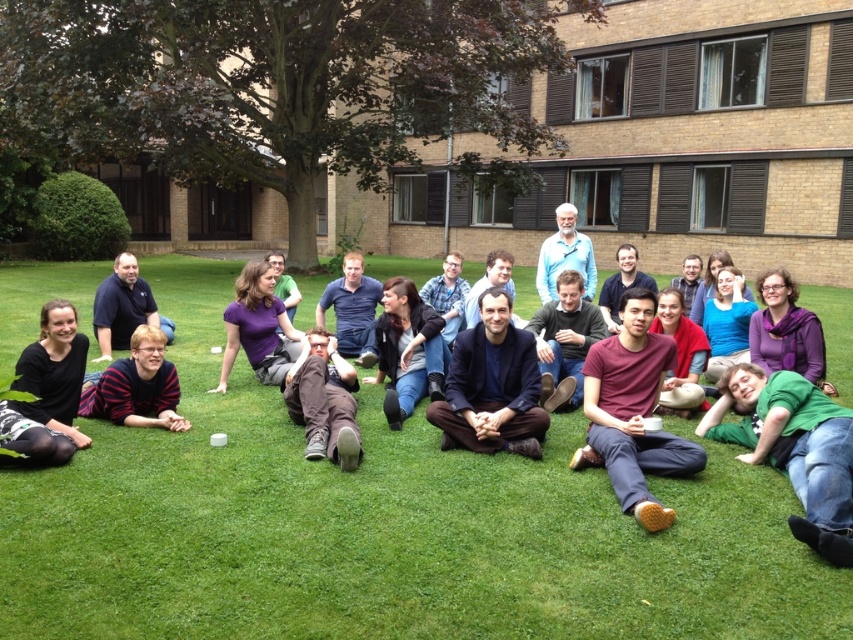
In the scene shown: You are planning to set up a small picnic blanket for a group of 5 people. The picnic blanket requires a space that is wider than the brown suede pants at center. Is there enough space on the green grass at center to accommodate the picnic blanket?

The green grass at center is wider than the brown suede pants at center, so yes, there is enough space on the green grass at center to accommodate the picnic blanket since its width exceeds the required space.

You are a photographer trying to capture a group photo of the people at the gathering. You notice the brown suede pants at center and the striped sweater at lower left in your frame. Which clothing item appears narrower in your current camera view?

The brown suede pants at center appears narrower than the striped sweater at lower left in the camera view because the brown suede pants at center has a lesser width compared to striped sweater at lower left.

You are standing in the middle of the group and want to step onto the green grass at center. Which direction should you move relative to the brown suede pants at center?

You should move to the left of the brown suede pants at center because the green grass at center is located to the left of the brown suede pants at center.